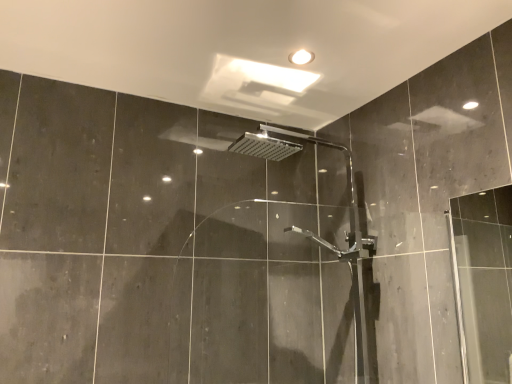
Question: Is white glossy light fixture at upper center taller than chrome metallic shower head at center?

Choices:
 (A) no
 (B) yes

Answer: (A)

Question: Is the depth of white glossy light fixture at upper center less than that of chrome metallic shower head at center?

Choices:
 (A) yes
 (B) no

Answer: (B)

Question: Is white glossy light fixture at upper center completely or partially outside of chrome metallic shower head at center?

Choices:
 (A) no
 (B) yes

Answer: (B)

Question: Is white glossy light fixture at upper center positioned behind chrome metallic shower head at center?

Choices:
 (A) no
 (B) yes

Answer: (B)

Question: Does white glossy light fixture at upper center have a smaller size compared to chrome metallic shower head at center?

Choices:
 (A) yes
 (B) no

Answer: (A)

Question: Could chrome metallic shower head at center be considered to be inside white glossy light fixture at upper center?

Choices:
 (A) yes
 (B) no

Answer: (B)

Question: Considering the relative positions of chrome metallic shower head at center and white glossy light fixture at upper center in the image provided, is chrome metallic shower head at center to the left of white glossy light fixture at upper center from the viewer's perspective?

Choices:
 (A) yes
 (B) no

Answer: (B)

Question: Is chrome metallic shower head at center closer to camera compared to white glossy light fixture at upper center?

Choices:
 (A) yes
 (B) no

Answer: (A)

Question: Considering the relative sizes of chrome metallic shower head at center and white glossy light fixture at upper center in the image provided, is chrome metallic shower head at center shorter than white glossy light fixture at upper center?

Choices:
 (A) yes
 (B) no

Answer: (B)

Question: Does chrome metallic shower head at center turn towards white glossy light fixture at upper center?

Choices:
 (A) no
 (B) yes

Answer: (A)

Question: Is chrome metallic shower head at center not within white glossy light fixture at upper center?

Choices:
 (A) no
 (B) yes

Answer: (B)

Question: Does chrome metallic shower head at center come behind white glossy light fixture at upper center?

Choices:
 (A) no
 (B) yes

Answer: (A)

Question: Relative to white glossy light fixture at upper center, is chrome metallic shower head at center in front or behind?

Choices:
 (A) front
 (B) behind

Answer: (A)